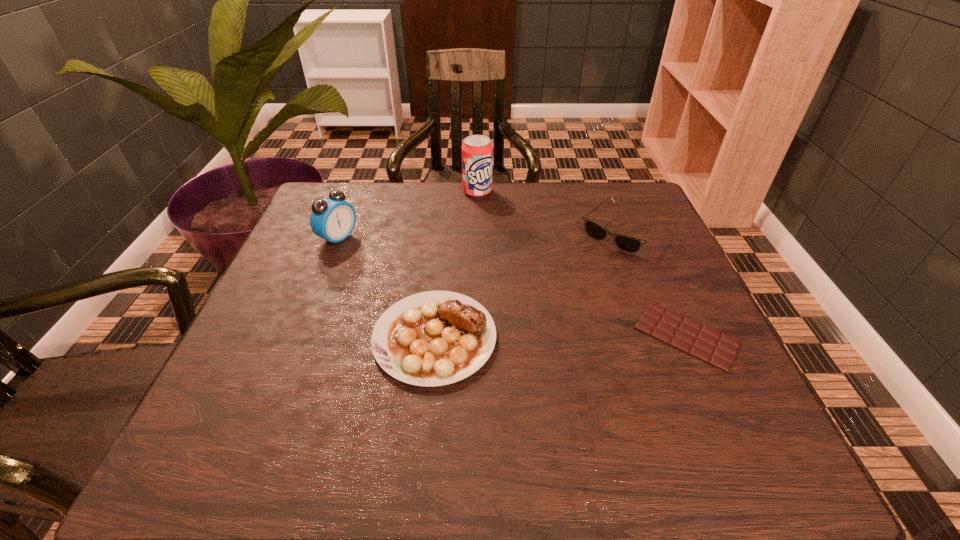
I want to click on vacant area situated on the face of the alarm clock, so click(462, 296).

Locate an element on the screen. Image resolution: width=960 pixels, height=540 pixels. blank space located 0.060m on the face of the alarm clock is located at coordinates coord(370,253).

The height and width of the screenshot is (540, 960). Identify the location of free space located 0.080m on the surface of the soda can. (489, 214).

Find the location of a particular element. The height and width of the screenshot is (540, 960). vacant region located on the surface of the soda can is located at coordinates (506, 248).

Where is `vacant space located 0.400m on the surface of the soda can`? vacant space located 0.400m on the surface of the soda can is located at coordinates (530, 295).

At what (x,y) coordinates should I click in order to perform the action: click on free spot located 0.250m on the lenses of the sunglasses. Please return your answer as a coordinate pair (x, y). Looking at the image, I should click on (549, 310).

Locate an element on the screen. vacant position located on the lenses of the sunglasses is located at coordinates (525, 336).

In order to click on blank space located on the lenses of the sunglasses in this screenshot , I will do `click(539, 321)`.

This screenshot has width=960, height=540. I want to click on alarm clock present at the far edge, so click(333, 219).

Find the location of a particular element. The width and height of the screenshot is (960, 540). soda can positioned at the far edge is located at coordinates (477, 152).